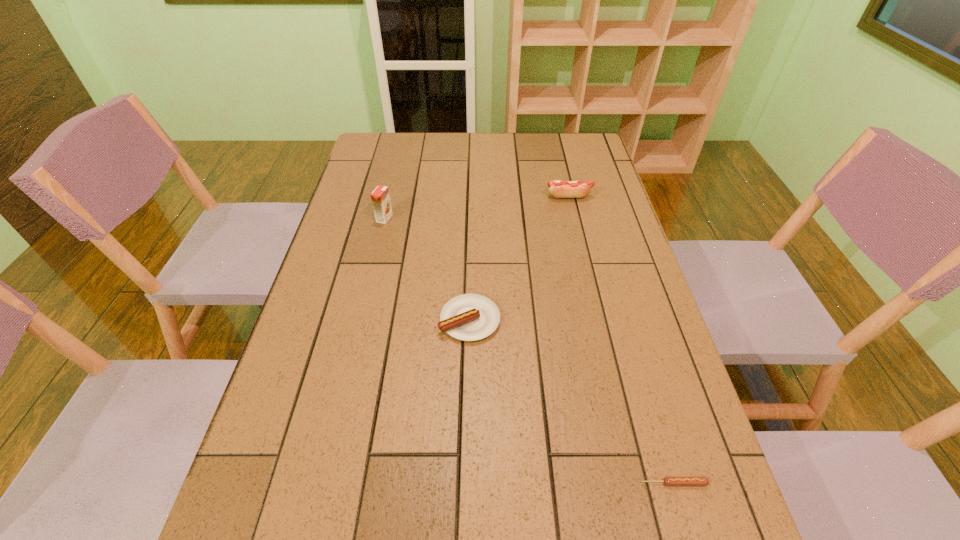
Locate an element on the screen. free spot located on the right of the leftmost sausage is located at coordinates (600, 320).

The height and width of the screenshot is (540, 960). In order to click on vacant space located on the back of the shortest object in this screenshot , I will do `click(659, 431)`.

I want to click on object that is at the left edge, so click(x=380, y=197).

Locate an element on the screen. This screenshot has height=540, width=960. vacant space at the far edge of the desktop is located at coordinates (475, 157).

The width and height of the screenshot is (960, 540). In the image, there is a desktop. What are the coordinates of `vacant space at the left edge` in the screenshot? It's located at (323, 287).

Where is `free point at the right edge`? The image size is (960, 540). free point at the right edge is located at coordinates (593, 227).

In the image, there is a desktop. Find the location of `free space at the far left corner`. free space at the far left corner is located at coordinates (406, 158).

This screenshot has height=540, width=960. I want to click on free region at the far right corner of the desktop, so click(x=590, y=144).

Find the location of a particular element. The width and height of the screenshot is (960, 540). empty location between the shortest object and the orange juice is located at coordinates (529, 350).

The image size is (960, 540). I want to click on empty location between the second object from left to right and the farthest object, so click(x=519, y=258).